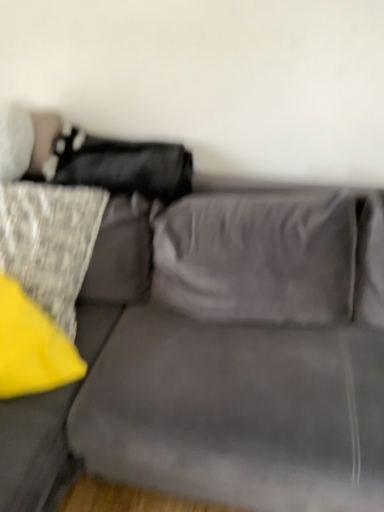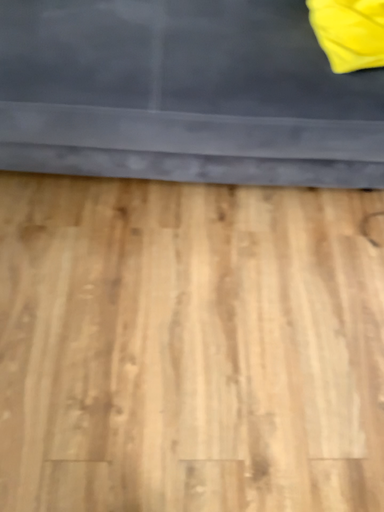
Question: Which way did the camera rotate in the video?

Choices:
 (A) rotated downward
 (B) rotated upward

Answer: (A)